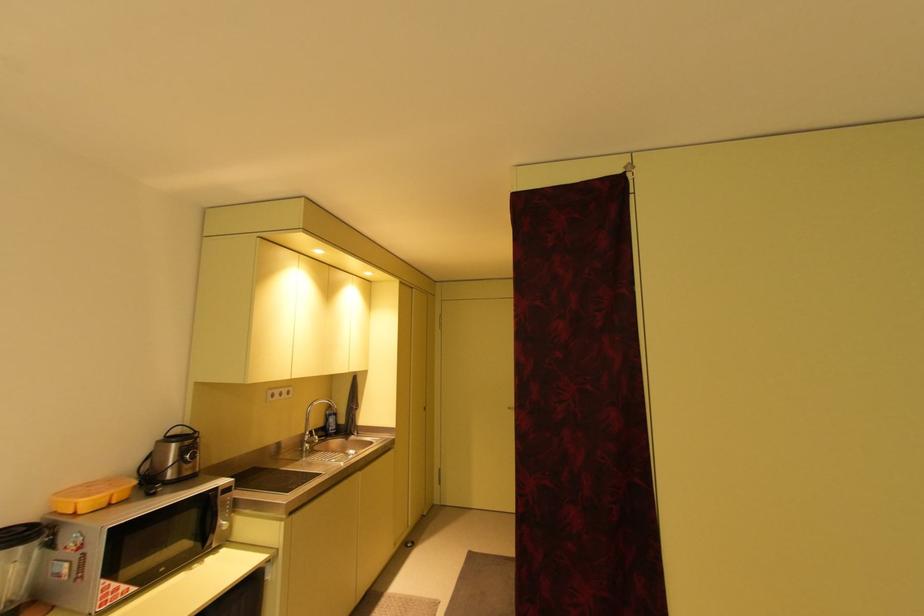
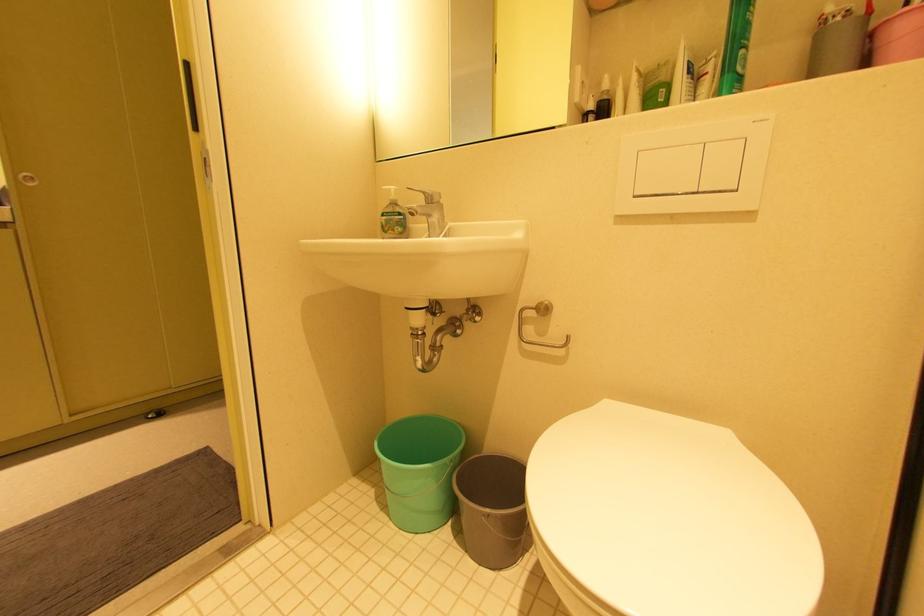
What movement of the cameraman would produce the second image?

The cameraman walked toward right, forward.